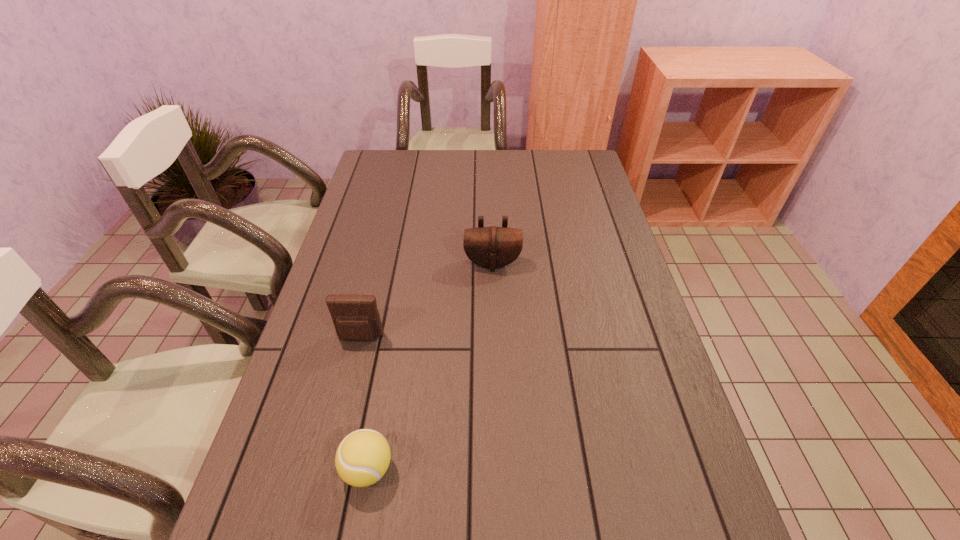
The image size is (960, 540). In order to click on free space that is in between the farthest object and the nearer pouch in this screenshot , I will do `click(426, 301)`.

Locate an element on the screen. free spot between the right pouch and the second farthest object is located at coordinates (426, 301).

Identify the location of blank region between the farther pouch and the tennis ball. (430, 366).

Locate an element on the screen. unoccupied position between the nearest object and the left pouch is located at coordinates (364, 403).

Identify which object is located as the nearest to the shortest object. Please provide its 2D coordinates. Your answer should be formatted as a tuple, i.e. [(x, y)], where the tuple contains the x and y coordinates of a point satisfying the conditions above.

[(355, 317)]

Find the location of a particular element. object that stands as the second closest to the nearest object is located at coordinates (492, 247).

The width and height of the screenshot is (960, 540). Identify the location of vacant area in the image that satisfies the following two spatial constraints: 1. with an open flap on the second farthest object; 2. on the left side of the tennis ball. (327, 469).

The image size is (960, 540). I want to click on free location that satisfies the following two spatial constraints: 1. with an open flap on the shortest object; 2. on the left side of the second nearest object, so click(x=327, y=469).

Where is `free point that satisfies the following two spatial constraints: 1. with an open flap on the second nearest object; 2. on the right side of the shortest object`? The height and width of the screenshot is (540, 960). free point that satisfies the following two spatial constraints: 1. with an open flap on the second nearest object; 2. on the right side of the shortest object is located at coordinates (327, 469).

Identify the location of free region that satisfies the following two spatial constraints: 1. with an open flap on the nearer pouch; 2. on the left side of the nearest object. (327, 469).